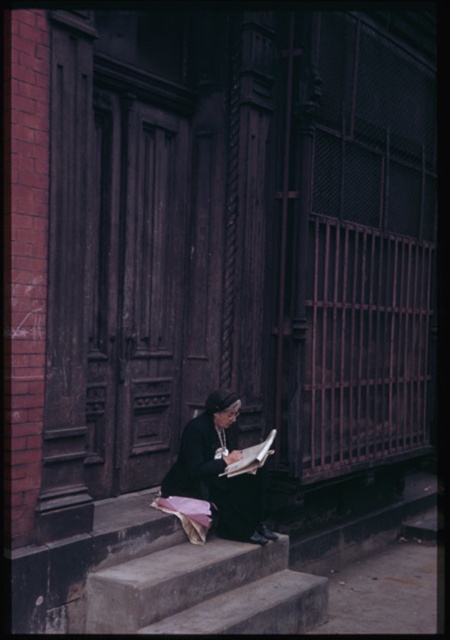
Can you confirm if concrete stairs at lower center is taller than black matte robe at lower center?

No.

Is point (175, 609) farther from camera compared to point (256, 492)?

No, it is in front of (256, 492).

What do you see at coordinates (203, 589) in the screenshot?
I see `concrete stairs at lower center` at bounding box center [203, 589].

Identify the location of concrete stairs at lower center. This screenshot has height=640, width=450. (203, 589).